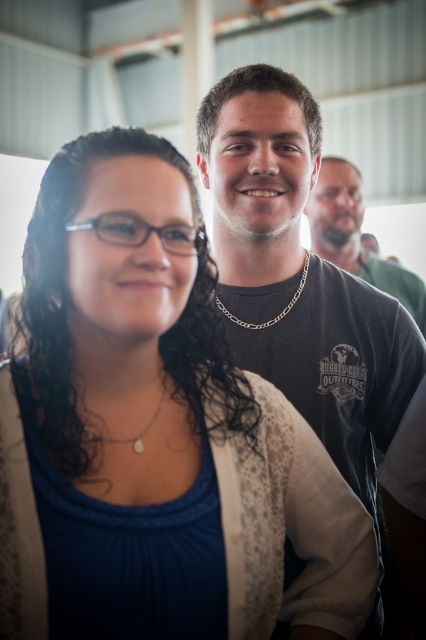
You are standing at the entrance of the warehouse and see two points marked in the scene. The first point is at coordinates point (166, 465) and the second point is at point (296, 273). Which of these two points is closer to you?

Point (166, 465) is closer to you because it is in front of point (296, 273).

Based on the photo, you are a fashion designer observing the image and want to ensure proper layering for a photoshoot. Since the matte white cardigan at center and pearl necklace at center are both focal points, which one should be placed higher to maintain visual hierarchy?

The matte white cardigan at center is located above pearl necklace at center, so to maintain visual hierarchy, the matte white cardigan at center should remain higher as it is already positioned above the pearl necklace at center.